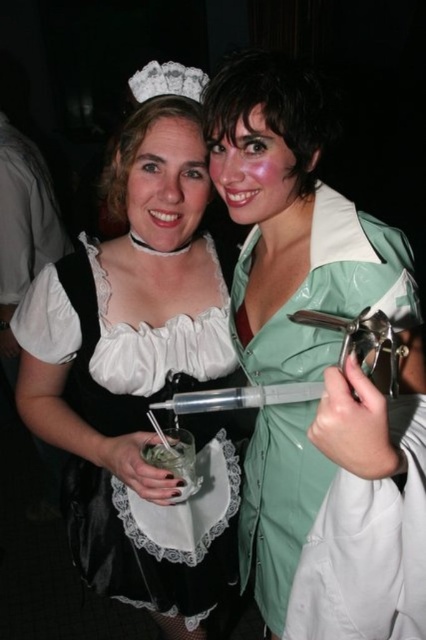
You are standing in front of the image and want to locate the white lace dress at center. What are its coordinates?

The white lace dress at center is located at coordinates (141, 369).

You are organizing a costume party and need to arrange two props on a shelf. The white lace dress at center and the green shiny syringe at center must be placed side by side. If the shelf has limited space, which prop should you place first to ensure both fit?

The white lace dress at center has a larger width than the green shiny syringe at center, so you should place the white lace dress at center first to accommodate its wider size before placing the green shiny shiny syringe at center.

You are a photographer at the themed event and want to capture a clear photo of both the white lace dress at center and the green shiny syringe at center. Which object should you focus on first to ensure both are in focus?

You should focus on the white lace dress at center first because it is closer to the viewer than the green shiny syringe at center. By focusing on the closer object, the syringe will also be in focus due to the depth of field.